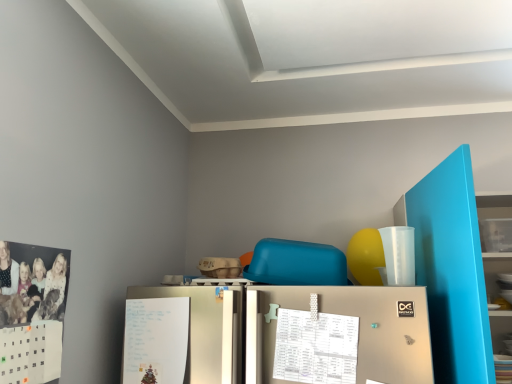
Question: Does matte blue bookshelf at right lie behind white paper calendar at center?

Choices:
 (A) yes
 (B) no

Answer: (B)

Question: Considering the relative sizes of matte blue bookshelf at right and white paper calendar at center in the image provided, is matte blue bookshelf at right thinner than white paper calendar at center?

Choices:
 (A) yes
 (B) no

Answer: (B)

Question: From the image's perspective, does matte blue bookshelf at right appear higher than white paper calendar at center?

Choices:
 (A) yes
 (B) no

Answer: (A)

Question: Can you confirm if matte blue bookshelf at right is bigger than white paper calendar at center?

Choices:
 (A) no
 (B) yes

Answer: (B)

Question: Is matte blue bookshelf at right looking in the opposite direction of white paper calendar at center?

Choices:
 (A) yes
 (B) no

Answer: (B)

Question: Is white paper at lower left spatially inside white paper calendar at center, or outside of it?

Choices:
 (A) outside
 (B) inside

Answer: (A)

Question: Looking at their shapes, would you say white paper at lower left is wider or thinner than white paper calendar at center?

Choices:
 (A) wide
 (B) thin

Answer: (A)

Question: In the image, is white paper at lower left on the left side or the right side of white paper calendar at center?

Choices:
 (A) left
 (B) right

Answer: (A)

Question: From the image's perspective, is white paper at lower left located above or below white paper calendar at center?

Choices:
 (A) below
 (B) above

Answer: (A)

Question: In the image, is white paper calendar at center on the left side or the right side of matte blue bookshelf at right?

Choices:
 (A) left
 (B) right

Answer: (A)

Question: From the image's perspective, is white paper calendar at center positioned above or below matte blue bookshelf at right?

Choices:
 (A) above
 (B) below

Answer: (B)

Question: Is point (337, 317) positioned closer to the camera than point (408, 210)?

Choices:
 (A) closer
 (B) farther

Answer: (A)

Question: Relative to matte blue bookshelf at right, is white paper calendar at center in front or behind?

Choices:
 (A) front
 (B) behind

Answer: (B)

Question: Is matte blue bookshelf at right inside or outside of white paper at lower left?

Choices:
 (A) outside
 (B) inside

Answer: (A)

Question: In the image, is matte blue bookshelf at right on the left side or the right side of white paper at lower left?

Choices:
 (A) right
 (B) left

Answer: (A)